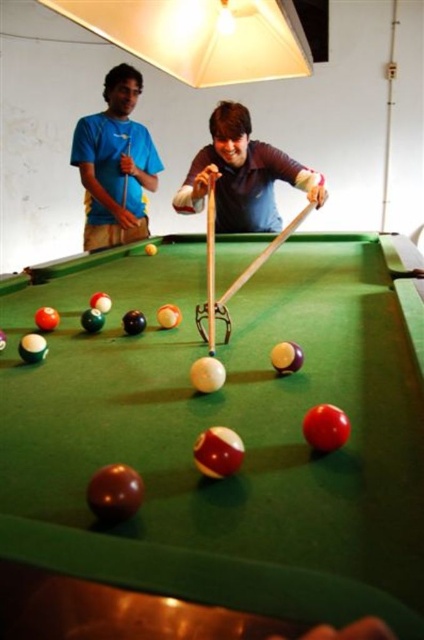
You are a pool player standing at the edge of the pool table and see the matte brown shirt at center and the matte wood cue at center. Which object is closer to you?

The matte brown shirt at center is closer to you because it is positioned under the matte wood cue at center, meaning the shirt is beneath the cue in the vertical plane, so the shirt is lower and thus closer to the observer.